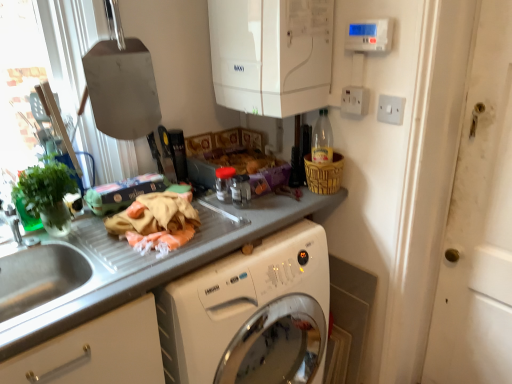
In order to click on vacant area that is situated to the right of green matte plant at left in this screenshot , I will do `click(94, 243)`.